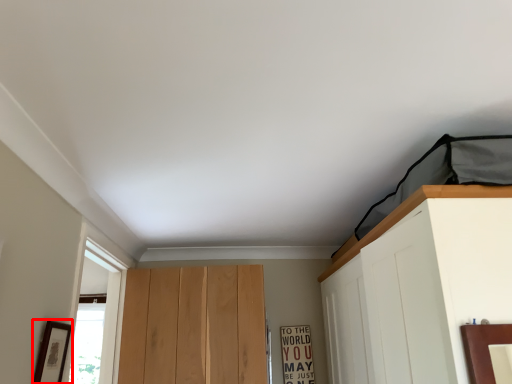
Question: From the image's perspective, where is picture frame (annotated by the red box) located in relation to warning sign in the image?

Choices:
 (A) below
 (B) above

Answer: (B)